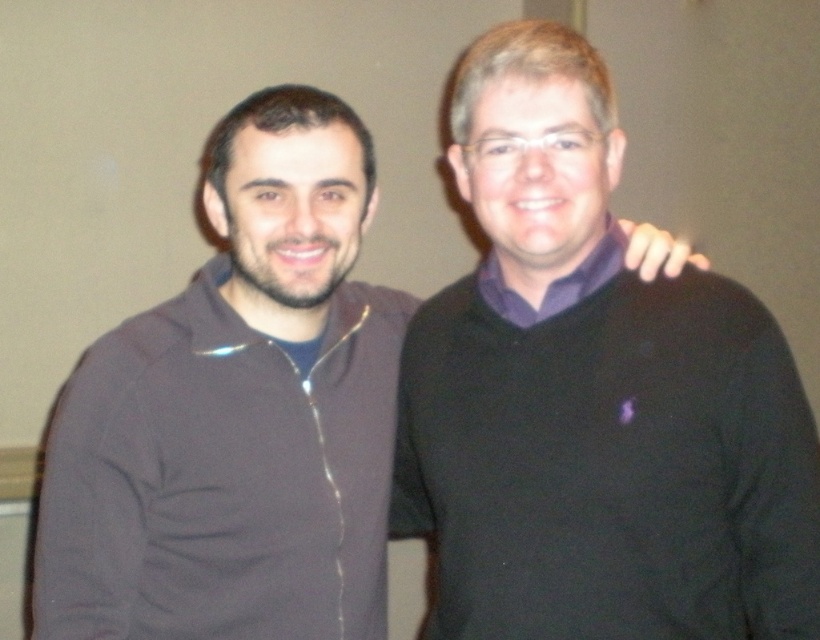
Question: In this image, where is black sweater at center located relative to dark matte sweater at center?

Choices:
 (A) below
 (B) above

Answer: (B)

Question: Which of the following is the farthest from the observer?

Choices:
 (A) black sweater at center
 (B) dark matte sweater at center

Answer: (B)

Question: Is black sweater at center to the right of dark matte sweater at center from the viewer's perspective?

Choices:
 (A) yes
 (B) no

Answer: (A)

Question: Is black sweater at center to the left of dark matte sweater at center from the viewer's perspective?

Choices:
 (A) no
 (B) yes

Answer: (A)